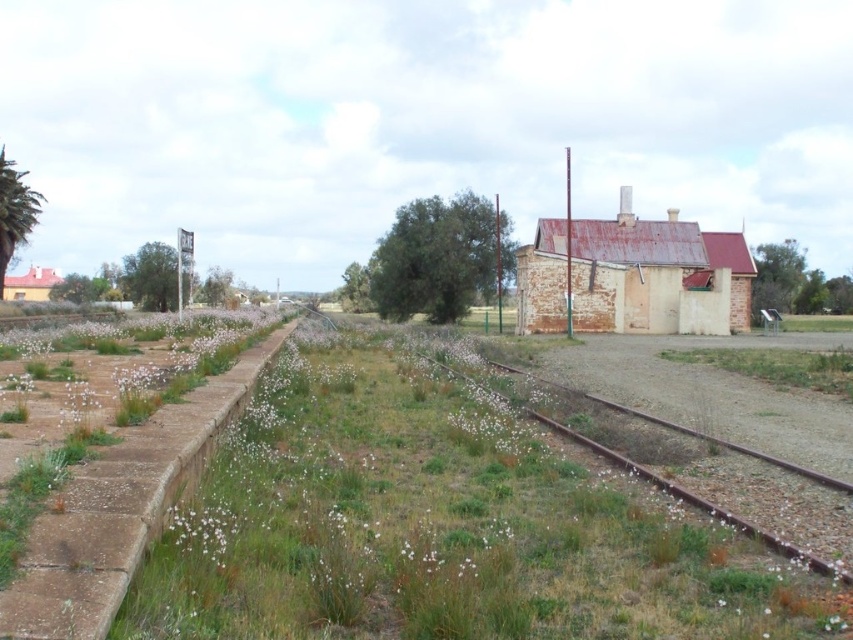
In the scene shown: You are a gardener planning to plant new flowers in the green grass at center and the rusty metal train track at center. Which area has more space available for planting?

The green grass at center has more space available for planting since it is bigger than the rusty metal train track at center.